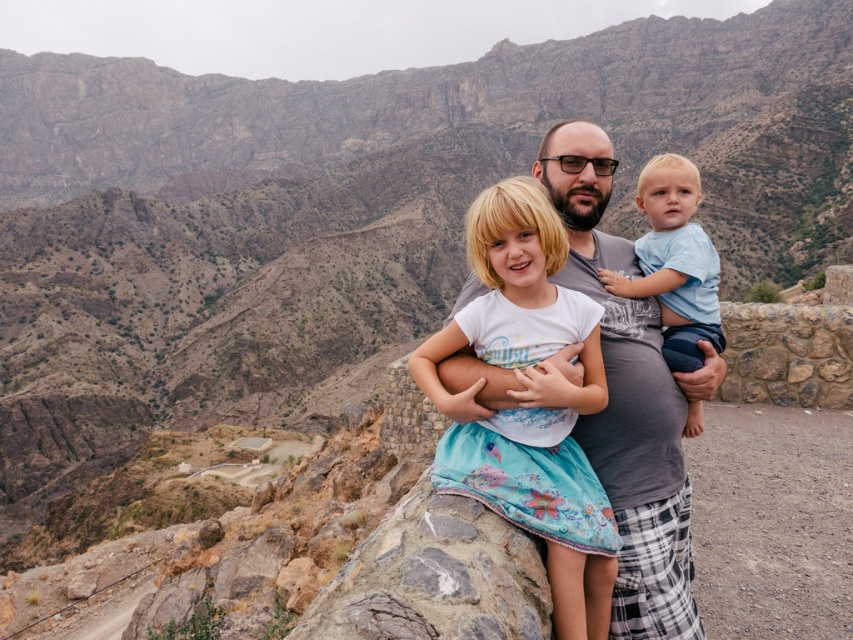
Question: Is white cotton dress at center smaller than light blue cotton shirt at center?

Choices:
 (A) no
 (B) yes

Answer: (A)

Question: Observing the image, what is the correct spatial positioning of white cotton dress at center in reference to light blue cotton shirt at center?

Choices:
 (A) below
 (B) above

Answer: (A)

Question: Which of the following is the farthest from the observer?

Choices:
 (A) white cotton dress at center
 (B) light blue cotton shirt at center

Answer: (B)

Question: Is white cotton dress at center above light blue cotton shirt at center?

Choices:
 (A) no
 (B) yes

Answer: (A)